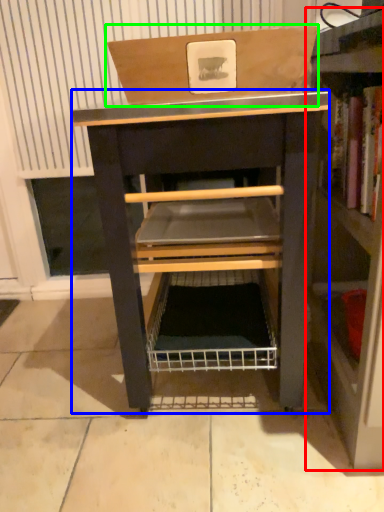
Question: Estimate the real-world distances between objects in this image. Which object is farther from shelf (highlighted by a red box), vanity (highlighted by a blue box) or cardboard box (highlighted by a green box)?

Choices:
 (A) vanity
 (B) cardboard box

Answer: (B)